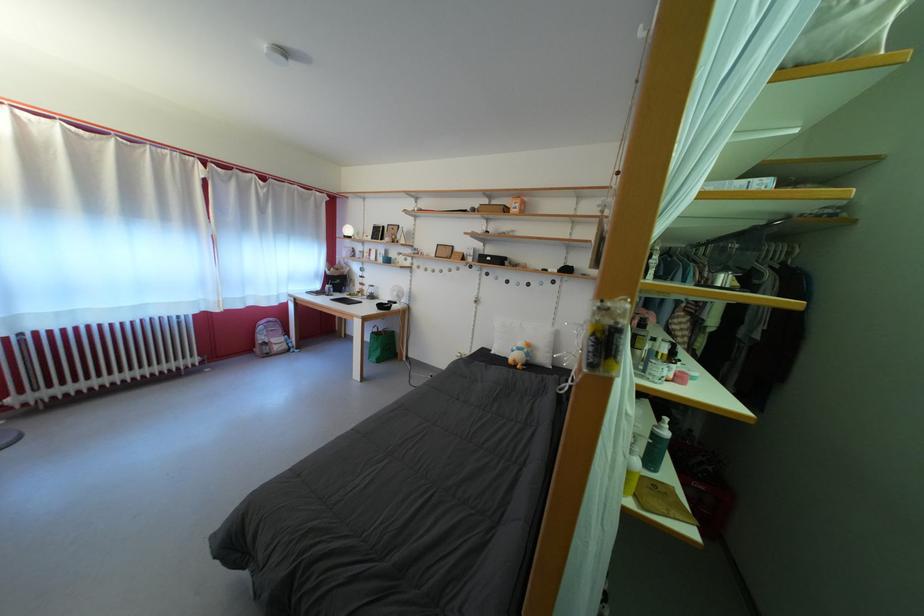
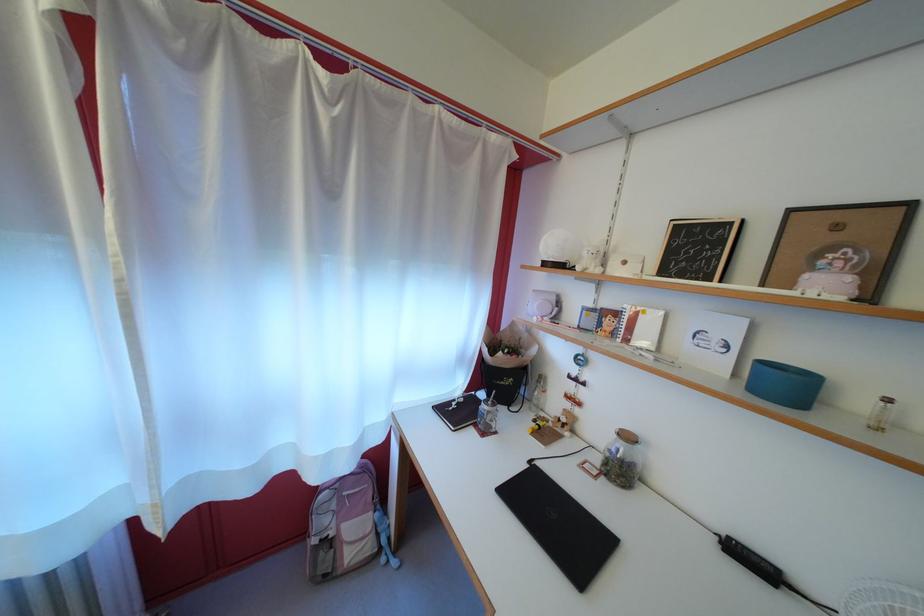
In the second image, find the point that corresponds to [271,217] in the first image.

(335, 193)